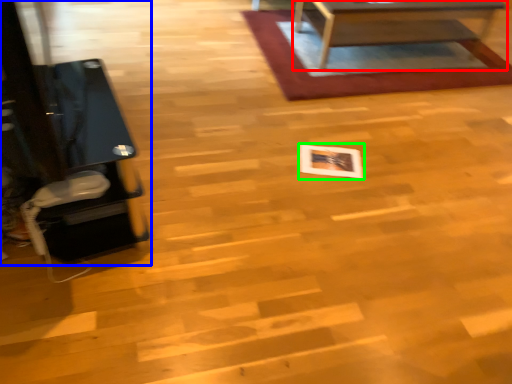
Question: Considering the real-world distances, which object is closest to table (highlighted by a red box)? furniture (highlighted by a blue box) or square (highlighted by a green box).

Choices:
 (A) furniture
 (B) square

Answer: (B)